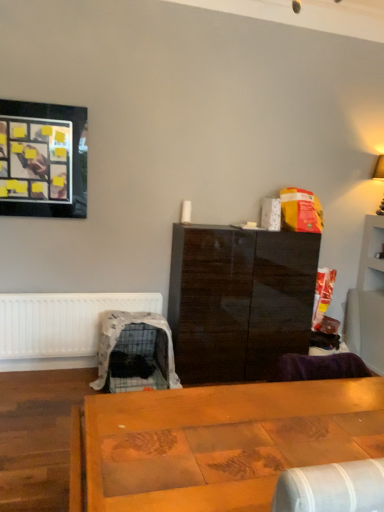
Find the location of a particular element. Image resolution: width=384 pixels, height=512 pixels. white matte radiator at lower left is located at coordinates (61, 322).

What is the approximate width of glossy dark wood cabinet at center?

It is 19.35 inches.

Describe the element at coordinates (216, 442) in the screenshot. This screenshot has width=384, height=512. I see `wooden table at center` at that location.

This screenshot has height=512, width=384. Describe the element at coordinates (43, 160) in the screenshot. I see `black glossy picture frame at upper left` at that location.

The image size is (384, 512). Identify the location of black glossy picture frame at upper left. (43, 160).

You are a GUI agent. You are given a task and a screenshot of the screen. Output one action in this format:
    pyautogui.click(x=<x>, y=<y>)
    Task: Click on the white matte radiator at lower left
    
    Given the screenshot: What is the action you would take?
    pyautogui.click(x=61, y=322)

From a real-world perspective, which object stands above the other?

From a 3D spatial view, black glossy picture frame at upper left is above.

Between white matte radiator at lower left and black glossy picture frame at upper left, which one has smaller width?

white matte radiator at lower left.

Which point is more forward, (37, 351) or (46, 168)?

The point (46, 168) is closer.

Considering the relative positions of white matte radiator at lower left and wooden table at center in the image provided, is white matte radiator at lower left to the right of wooden table at center from the viewer's perspective?

No, white matte radiator at lower left is not to the right of wooden table at center.

Which of these two, white matte radiator at lower left or wooden table at center, is thinner?

white matte radiator at lower left is thinner.

Is point (8, 304) closer or farther from the camera than point (326, 400)?

Point (8, 304) is positioned farther from the camera compared to point (326, 400).

Can you confirm if plastic covered pet crate at lower left is taller than black glossy picture frame at upper left?

Incorrect, the height of plastic covered pet crate at lower left is not larger of that of black glossy picture frame at upper left.

Is plastic covered pet crate at lower left smaller than black glossy picture frame at upper left?

No.

Is plastic covered pet crate at lower left not inside black glossy picture frame at upper left?

plastic covered pet crate at lower left lies outside black glossy picture frame at upper left's area.

Is there a large distance between plastic covered pet crate at lower left and black glossy picture frame at upper left?

Yes, plastic covered pet crate at lower left is far from black glossy picture frame at upper left.

From the image's perspective, which one is positioned higher, black glossy picture frame at upper left or wooden table at center?

black glossy picture frame at upper left appears higher in the image.

Is the surface of black glossy picture frame at upper left in direct contact with wooden table at center?

A: No, black glossy picture frame at upper left is not beside wooden table at center.

Would you say black glossy picture frame at upper left is inside or outside wooden table at center?

black glossy picture frame at upper left is not inside wooden table at center, it's outside.

Is black glossy picture frame at upper left positioned far away from white matte radiator at lower left?

No, black glossy picture frame at upper left is not far from white matte radiator at lower left.

Which object is closer to the camera, black glossy picture frame at upper left or white matte radiator at lower left?

black glossy picture frame at upper left is in front.

From their relative heights in the image, would you say black glossy picture frame at upper left is taller or shorter than white matte radiator at lower left?

Clearly, black glossy picture frame at upper left is taller compared to white matte radiator at lower left.

From the image's perspective, is black glossy picture frame at upper left beneath white matte radiator at lower left?

No, from the image's perspective, black glossy picture frame at upper left is not beneath white matte radiator at lower left.

Is wooden table at center not near plastic covered pet crate at lower left?

Yes, wooden table at center and plastic covered pet crate at lower left are quite far apart.

From the image's perspective, is wooden table at center above plastic covered pet crate at lower left?

Indeed, from the image's perspective, wooden table at center is shown above plastic covered pet crate at lower left.

Which object is wider, wooden table at center or plastic covered pet crate at lower left?

wooden table at center.

Is wooden table at center to the right of plastic covered pet crate at lower left from the viewer's perspective?

Indeed, wooden table at center is positioned on the right side of plastic covered pet crate at lower left.

Is point (99, 468) closer or farther from the camera than point (6, 338)?

Clearly, point (99, 468) is closer to the camera than point (6, 338).

How many degrees apart are the facing directions of wooden table at center and white matte radiator at lower left?

There is a 177-degree angle between the facing directions of wooden table at center and white matte radiator at lower left.

From the image's perspective, between wooden table at center and white matte radiator at lower left, which one is located above?

white matte radiator at lower left.

Locate an element on the screen. Image resolution: width=384 pixels, height=512 pixels. radiator that appears above the wooden table at center (from the image's perspective) is located at coordinates (61, 322).

Locate an element on the screen. Image resolution: width=384 pixels, height=512 pixels. radiator beneath the black glossy picture frame at upper left (from a real-world perspective) is located at coordinates (61, 322).

The width and height of the screenshot is (384, 512). Identify the location of radiator above the wooden table at center (from the image's perspective). (61, 322).

Which object lies nearer to the anchor point wooden table at center, black glossy picture frame at upper left or glossy dark wood cabinet at center?

The object closer to wooden table at center is glossy dark wood cabinet at center.

Considering their positions, is plastic covered pet crate at lower left positioned closer to wooden table at center than white matte radiator at lower left?

plastic covered pet crate at lower left.

Looking at the image, which one is located further to white matte radiator at lower left, glossy dark wood cabinet at center or plastic covered pet crate at lower left?

The object further to white matte radiator at lower left is glossy dark wood cabinet at center.

Which object lies further to the anchor point white matte radiator at lower left, plastic covered pet crate at lower left or glossy dark wood cabinet at center?

Based on the image, glossy dark wood cabinet at center appears to be further to white matte radiator at lower left.

When comparing their distances from white matte radiator at lower left, does plastic covered pet crate at lower left or black glossy picture frame at upper left seem further?

Among the two, black glossy picture frame at upper left is located further to white matte radiator at lower left.

When comparing their distances from black glossy picture frame at upper left, does white matte radiator at lower left or plastic covered pet crate at lower left seem closer?

Among the two, white matte radiator at lower left is located nearer to black glossy picture frame at upper left.

From the image, which object appears to be farther from white matte radiator at lower left, black glossy picture frame at upper left or glossy dark wood cabinet at center?

Based on the image, black glossy picture frame at upper left appears to be further to white matte radiator at lower left.

Looking at the image, which one is located closer to wooden table at center, plastic covered pet crate at lower left or glossy dark wood cabinet at center?

plastic covered pet crate at lower left lies closer to wooden table at center than the other object.

The image size is (384, 512). Find the location of `swivel chair located between black glossy picture frame at upper left and glossy dark wood cabinet at center in the left-right direction`. swivel chair located between black glossy picture frame at upper left and glossy dark wood cabinet at center in the left-right direction is located at coordinates (135, 353).

Find the location of a particular element. This screenshot has height=512, width=384. swivel chair between wooden table at center and glossy dark wood cabinet at center from front to back is located at coordinates (135, 353).

I want to click on picture frame positioned between wooden table at center and glossy dark wood cabinet at center from near to far, so click(x=43, y=160).

The width and height of the screenshot is (384, 512). In order to click on swivel chair between white matte radiator at lower left and glossy dark wood cabinet at center in the horizontal direction in this screenshot , I will do `click(135, 353)`.